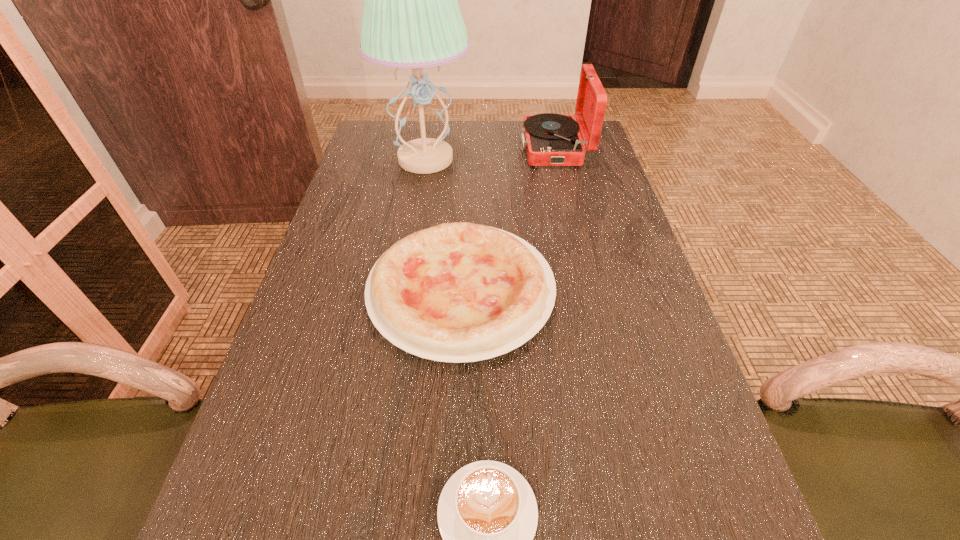
Where is `vacant region between the second tallest object and the tallest object`? The image size is (960, 540). vacant region between the second tallest object and the tallest object is located at coordinates (491, 154).

You are a GUI agent. You are given a task and a screenshot of the screen. Output one action in this format:
    pyautogui.click(x=<x>, y=<y>)
    Task: Click on the object that is the second closest one to the third farthest object
    The width and height of the screenshot is (960, 540).
    Given the screenshot: What is the action you would take?
    pyautogui.click(x=411, y=18)

At what (x,y) coordinates should I click in order to perform the action: click on object that stands as the second closest to the tallest object. Please return your answer as a coordinate pair (x, y). The image size is (960, 540). Looking at the image, I should click on (457, 292).

Locate an element on the screen. This screenshot has width=960, height=540. free region that satisfies the following two spatial constraints: 1. on the front side of the lamp; 2. on the right side of the pizza is located at coordinates (403, 292).